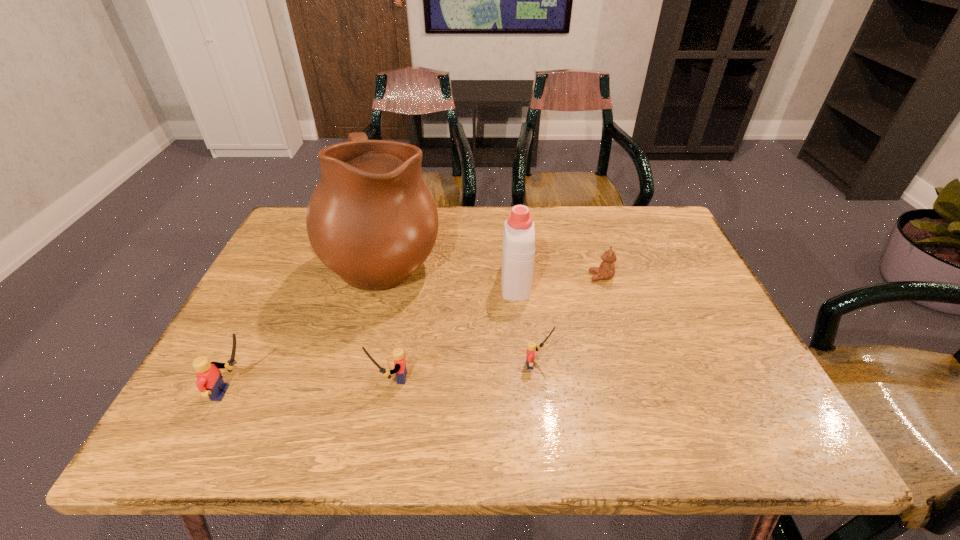
Where is `object present at the far edge`? This screenshot has height=540, width=960. object present at the far edge is located at coordinates (371, 219).

Where is `Lego present at the left edge`? The width and height of the screenshot is (960, 540). Lego present at the left edge is located at coordinates (210, 382).

This screenshot has height=540, width=960. I want to click on cream pitcher present at the left edge, so click(371, 219).

You are a GUI agent. You are given a task and a screenshot of the screen. Output one action in this format:
    pyautogui.click(x=<x>, y=<y>)
    Task: Click on the object at the far left corner
    The height and width of the screenshot is (540, 960).
    Given the screenshot: What is the action you would take?
    pyautogui.click(x=371, y=219)

Find the location of a particular element. This screenshot has width=960, height=540. object present at the near left corner is located at coordinates (210, 382).

In the image, there is a desktop. At what (x,y) coordinates should I click in order to perform the action: click on vacant space at the far edge. Please return your answer as a coordinate pair (x, y). The height and width of the screenshot is (540, 960). Looking at the image, I should click on click(600, 227).

Where is `free space at the near edge`? The height and width of the screenshot is (540, 960). free space at the near edge is located at coordinates (653, 400).

Find the location of a particular element. Image resolution: width=960 pixels, height=540 pixels. blank area at the far right corner is located at coordinates (668, 240).

The height and width of the screenshot is (540, 960). I want to click on unoccupied area between the fourth tallest object and the leftmost Lego, so click(x=313, y=386).

Identify the location of free area in between the cream pitcher and the second tallest object. This screenshot has height=540, width=960. (450, 269).